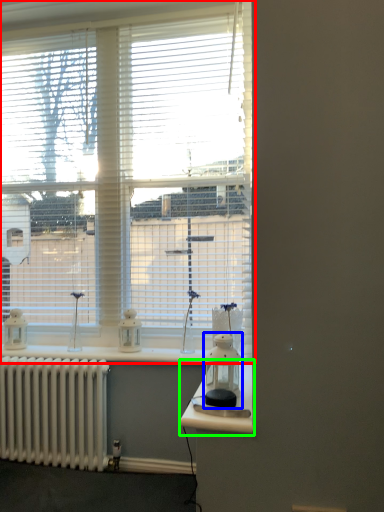
Question: Which is nearer to the window (highlighted by a red box)? appliance (highlighted by a blue box) or table (highlighted by a green box).

Choices:
 (A) appliance
 (B) table

Answer: (A)